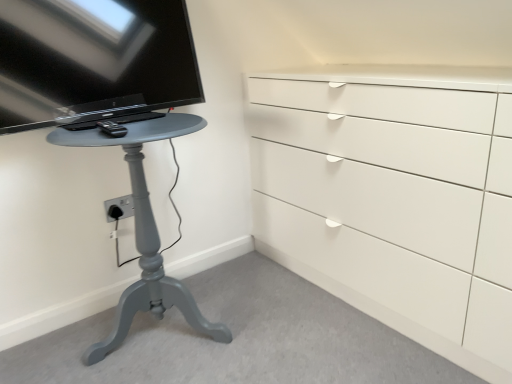
This screenshot has width=512, height=384. I want to click on empty space that is to the right of matte gray table at left, so click(272, 330).